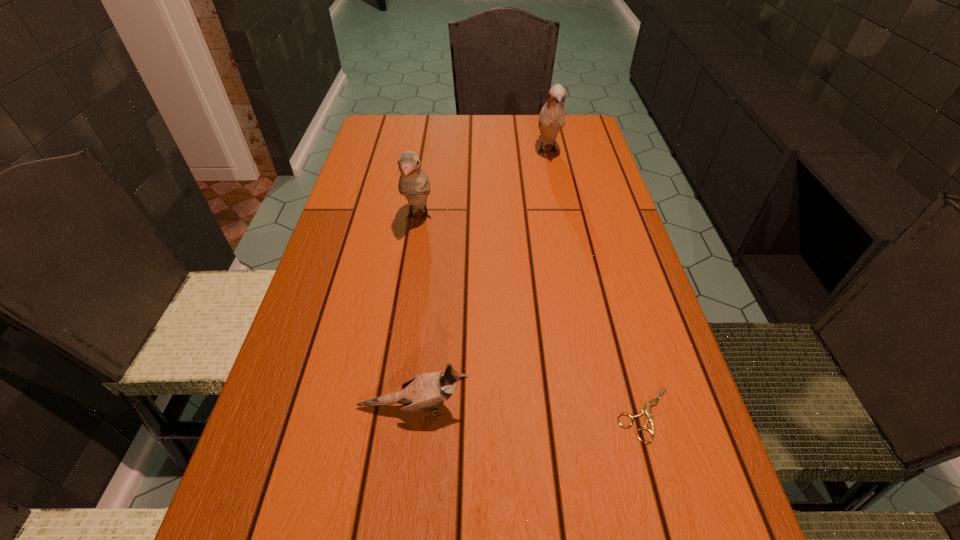
The width and height of the screenshot is (960, 540). In order to click on vacant point located between the third nearest object and the shears in this screenshot , I will do pyautogui.click(x=532, y=316).

Find the location of `free point between the nearest bird and the third nearest object`. free point between the nearest bird and the third nearest object is located at coordinates (416, 313).

You are a GUI agent. You are given a task and a screenshot of the screen. Output one action in this format:
    pyautogui.click(x=<x>, y=<y>)
    Task: Click on the vacant space in between the shears and the third tallest object
    
    Given the screenshot: What is the action you would take?
    pyautogui.click(x=529, y=411)

The width and height of the screenshot is (960, 540). I want to click on empty space that is in between the rightmost bird and the second nearest bird, so click(483, 185).

I want to click on free space between the farthest bird and the third tallest object, so click(481, 280).

In order to click on vacant region between the shortest object and the third tallest object in this screenshot , I will do `click(529, 411)`.

This screenshot has width=960, height=540. Find the location of `free space between the farthest bird and the shears`. free space between the farthest bird and the shears is located at coordinates (596, 283).

This screenshot has width=960, height=540. Identify the location of free space between the farthest bird and the second shortest object. (481, 280).

This screenshot has width=960, height=540. Identify the location of free space between the second nearest bird and the farthest object. (483, 185).

Identify which object is located as the third nearest to the rightmost bird. Please provide its 2D coordinates. Your answer should be formatted as a tuple, i.e. [(x, y)], where the tuple contains the x and y coordinates of a point satisfying the conditions above.

[(424, 392)]